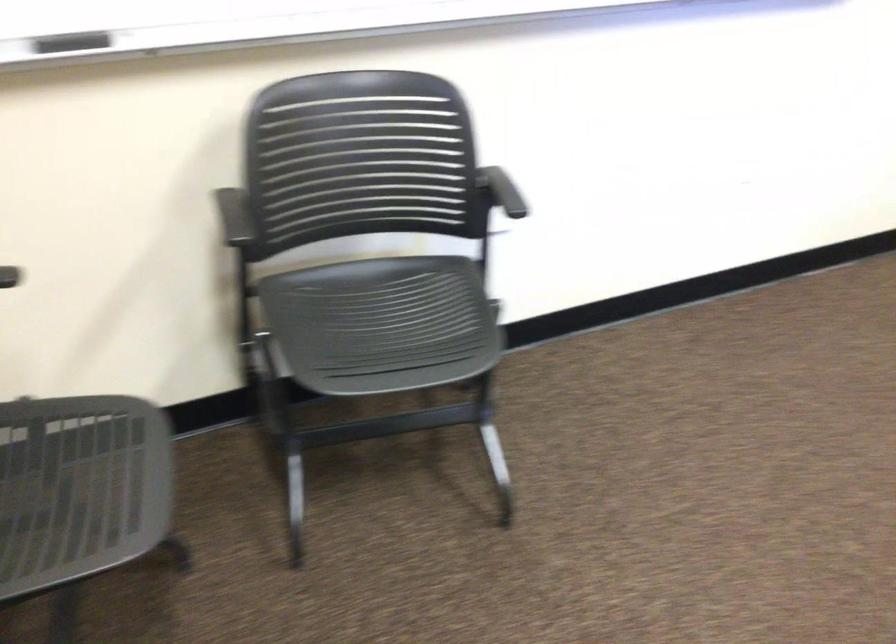
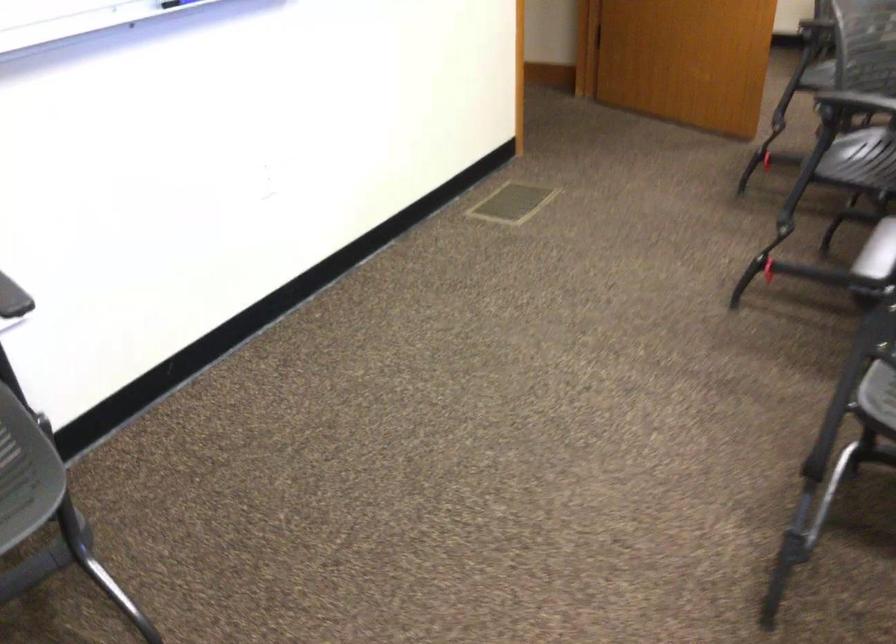
Question: The camera is either moving clockwise (left) or counter-clockwise (right) around the object. The first image is from the beginning of the video and the second image is from the end. Is the camera moving left or right when shooting the video?

Choices:
 (A) Left
 (B) Right

Answer: (A)